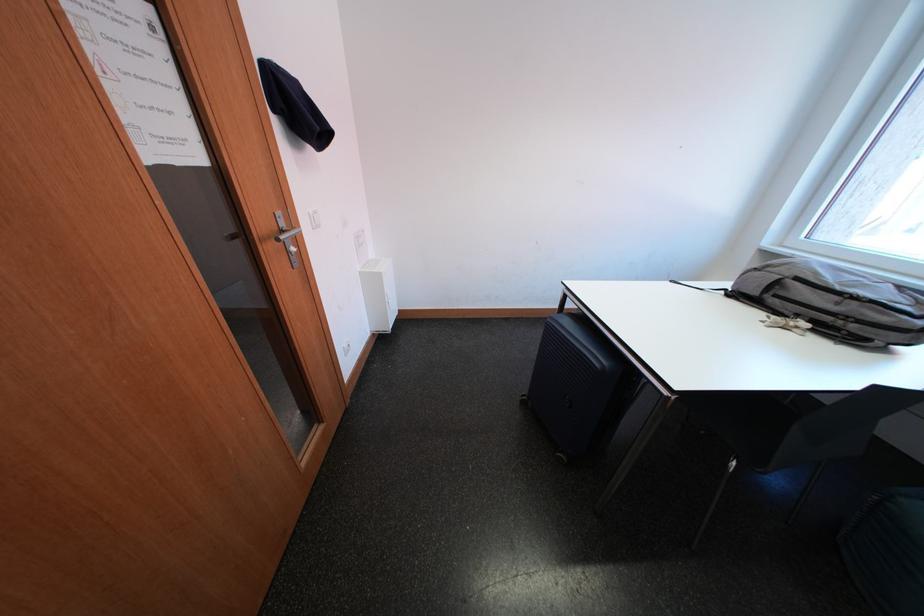
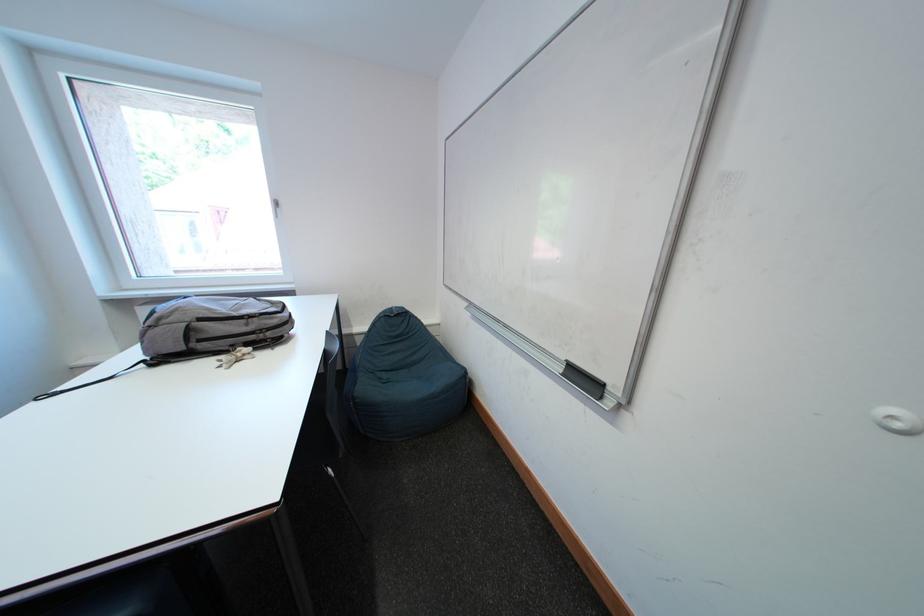
The first image is from the beginning of the video and the second image is from the end. How did the camera likely rotate when shooting the video?

The camera's rotation is toward right-down.